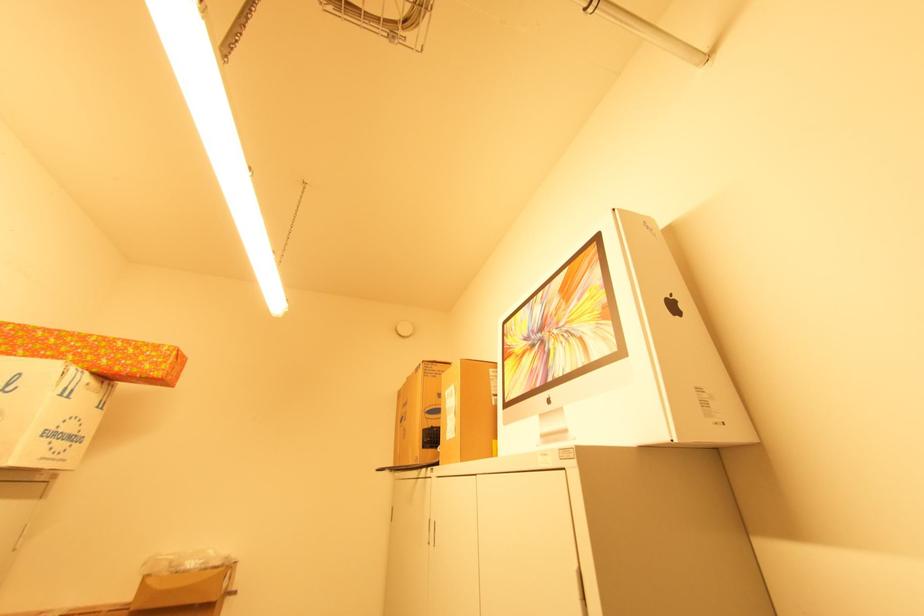
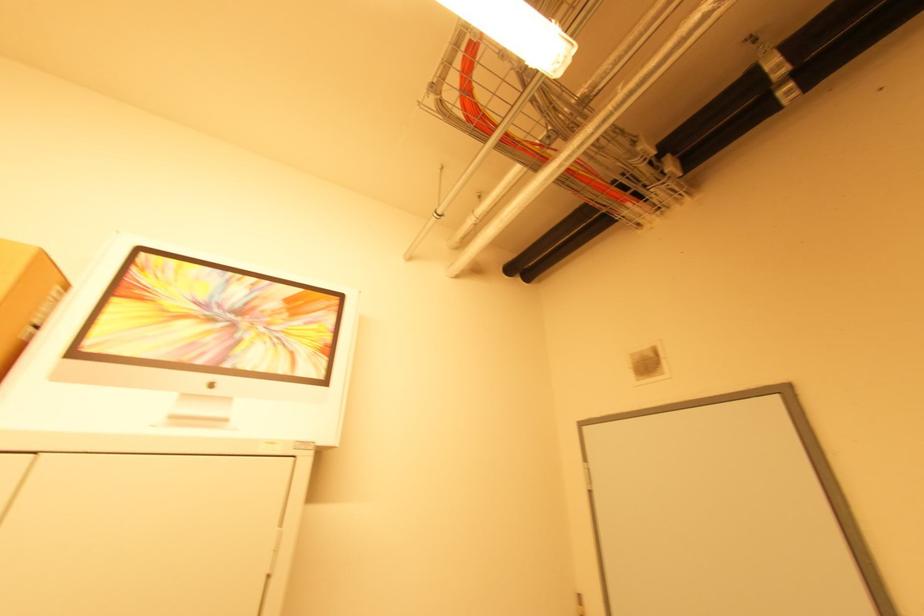
Where in the second image is the point corresponding to point (507, 363) from the first image?

(117, 300)